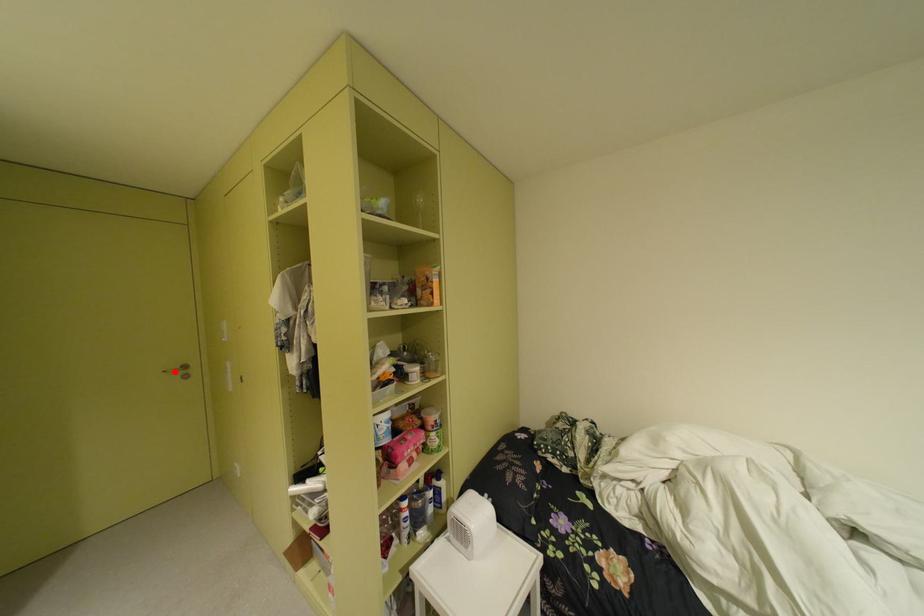
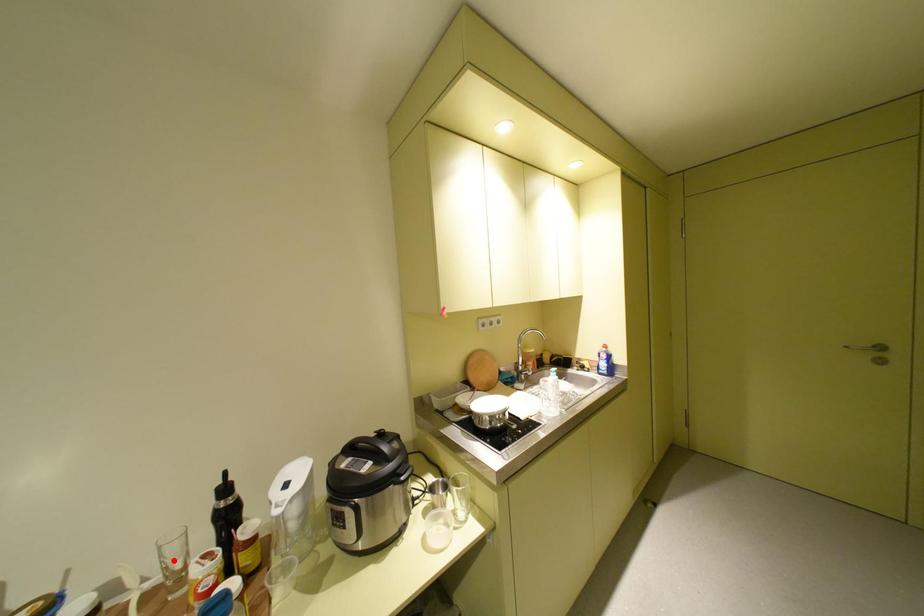
I am providing you with two images of the same scene from different viewpoints. A red point is marked on the first image and another point is marked on the second image. Is the marked point in image1 the same physical position as the marked point in image2?

No